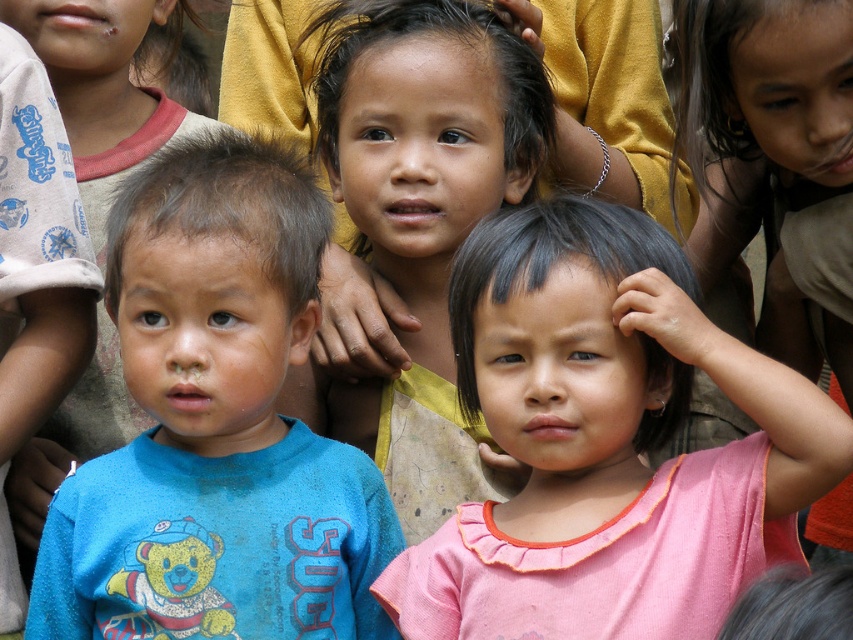
Is blue cotton shirt at left to the left of matte yellow shirt at center from the viewer's perspective?

Correct, you'll find blue cotton shirt at left to the left of matte yellow shirt at center.

Is blue cotton shirt at left above matte yellow shirt at center?

No.

Is point (140, 460) positioned behind point (476, 13)?

That is False.

Where is `blue cotton shirt at left`? This screenshot has height=640, width=853. blue cotton shirt at left is located at coordinates (215, 426).

Can you confirm if pink fabric shirt at center is thinner than blue cotton shirt at left?

No, pink fabric shirt at center is not thinner than blue cotton shirt at left.

Between point (618, 330) and point (267, 323), which one is positioned in front?

Point (618, 330)

At what (x,y) coordinates should I click in order to perform the action: click on pink fabric shirt at center. Please return your answer as a coordinate pair (x, y). Looking at the image, I should click on 604,442.

Is pink fabric shirt at center shorter than matte yellow shirt at center?

Yes, pink fabric shirt at center is shorter than matte yellow shirt at center.

Is pink fabric shirt at center thinner than matte yellow shirt at center?

Incorrect, pink fabric shirt at center's width is not less than matte yellow shirt at center's.

Image resolution: width=853 pixels, height=640 pixels. Find the location of `pink fabric shirt at center`. pink fabric shirt at center is located at coordinates pos(604,442).